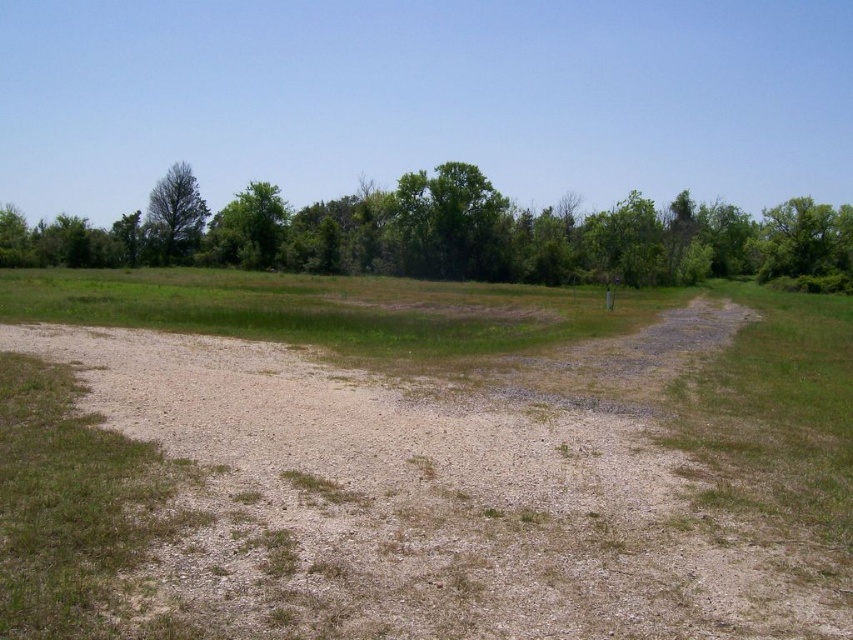
Image resolution: width=853 pixels, height=640 pixels. Find the location of `green leafy tree at upper center`. green leafy tree at upper center is located at coordinates (450, 236).

Is point (78, 221) closer to viewer compared to point (488, 256)?

No.

I want to click on green leafy tree at upper center, so click(450, 236).

Is point (583, 618) closer to camera compared to point (445, 211)?

Yes.

Is brown gravel dirt track at center wider than green leafy tree at upper center?

Incorrect, brown gravel dirt track at center's width does not surpass green leafy tree at upper center's.

You are a GUI agent. You are given a task and a screenshot of the screen. Output one action in this format:
    pyautogui.click(x=<x>, y=<y>)
    Task: Click on the brown gravel dirt track at center
    This screenshot has width=853, height=640.
    Given the screenshot: What is the action you would take?
    444,490

Between green leafy tree at upper center and green leafy tree at left, which one appears on the left side from the viewer's perspective?

green leafy tree at left is more to the left.

Between point (381, 236) and point (199, 225), which one is positioned behind?

Point (199, 225)

Between point (642, 227) and point (192, 176), which one is positioned in front?

Point (642, 227) is more forward.

Where is `green leafy tree at upper center`? The image size is (853, 640). green leafy tree at upper center is located at coordinates (450, 236).